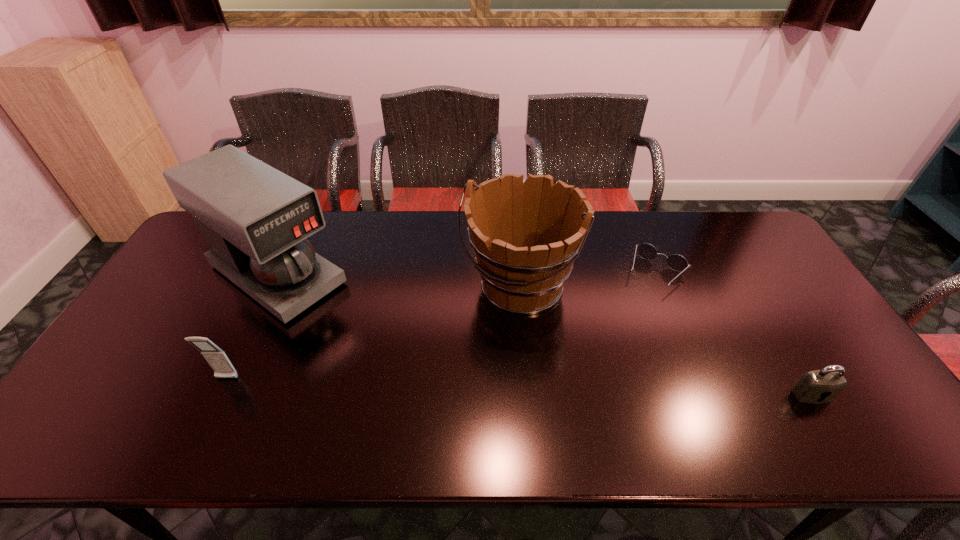
Locate an element on the screen. This screenshot has height=540, width=960. vacant point located between the fourth object from left to right and the nearest object is located at coordinates (733, 334).

At what (x,y) coordinates should I click in order to perform the action: click on empty space between the shortest object and the fourth farthest object. Please return your answer as a coordinate pair (x, y). This screenshot has height=540, width=960. Looking at the image, I should click on (442, 326).

This screenshot has height=540, width=960. Find the location of `object that is the closest to the second nearest object`. object that is the closest to the second nearest object is located at coordinates (255, 219).

Identify which object is the third closest to the wine bucket. Please provide its 2D coordinates. Your answer should be formatted as a tuple, i.e. [(x, y)], where the tuple contains the x and y coordinates of a point satisfying the conditions above.

[(821, 386)]

Find the location of a particular element. free spot that satisfies the following two spatial constraints: 1. on the back side of the third object from right to left; 2. on the left side of the spectacles is located at coordinates (517, 273).